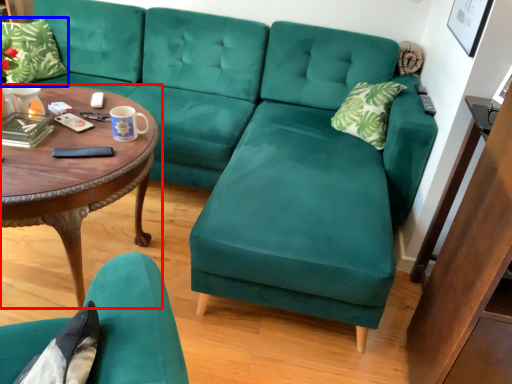
Question: Which point is closer to the camera, coffee table (highlighted by a red box) or pillow (highlighted by a blue box)?

Choices:
 (A) coffee table
 (B) pillow

Answer: (A)